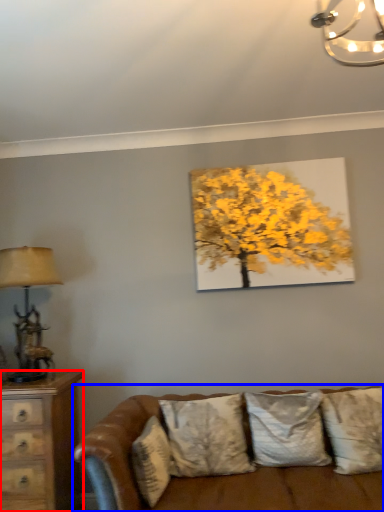
Question: Which object is closer to the camera taking this photo, chest of drawers (highlighted by a red box) or studio couch (highlighted by a blue box)?

Choices:
 (A) chest of drawers
 (B) studio couch

Answer: (B)